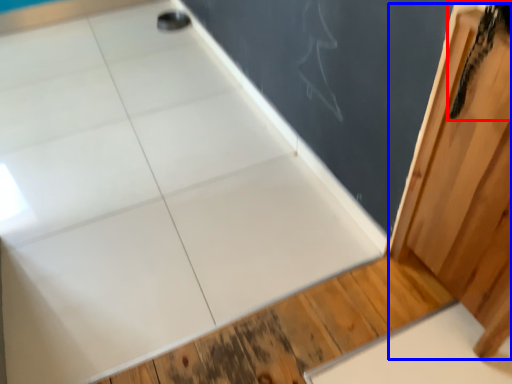
Question: Among these objects, which one is farthest to the camera, animal (highlighted by a red box) or barn door (highlighted by a blue box)?

Choices:
 (A) animal
 (B) barn door

Answer: (A)